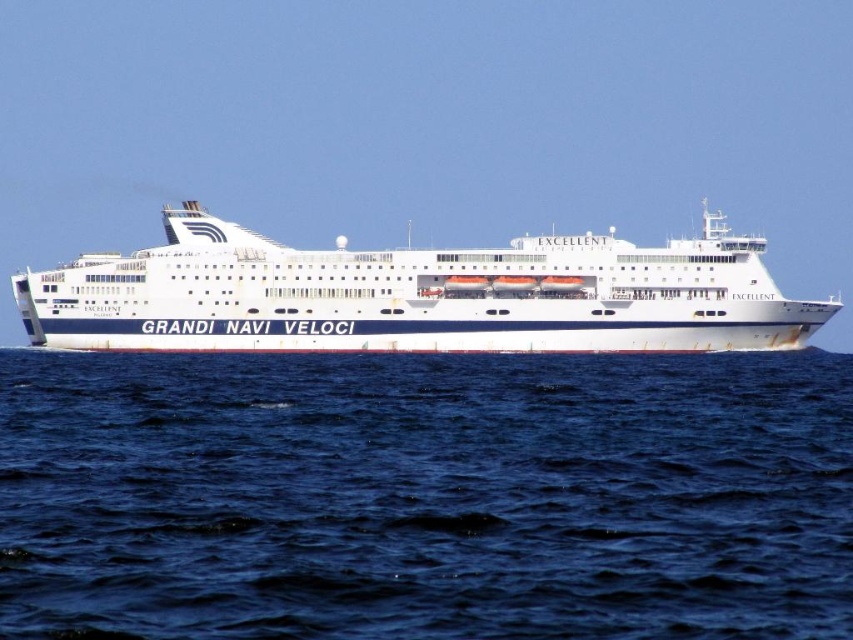
You are a photographer trying to capture the entire white glossy cruise ship at center in your shot. However, there is blue water at center in the way. Can you adjust your camera angle to include the entire ship without the water blocking it?

The blue water at center is narrower than the white glossy cruise ship at center, so adjusting the camera angle to focus on the ship while minimizing the water might allow capturing the entire ship without obstruction.